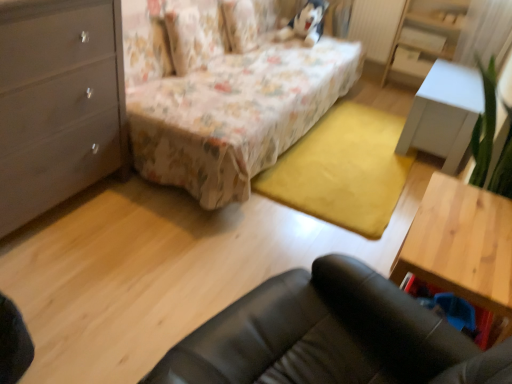
The image size is (512, 384). In order to click on free region on the left part of white glossy table at right, placed as the 1th table when sorted from top to bottom in this screenshot , I will do `click(359, 130)`.